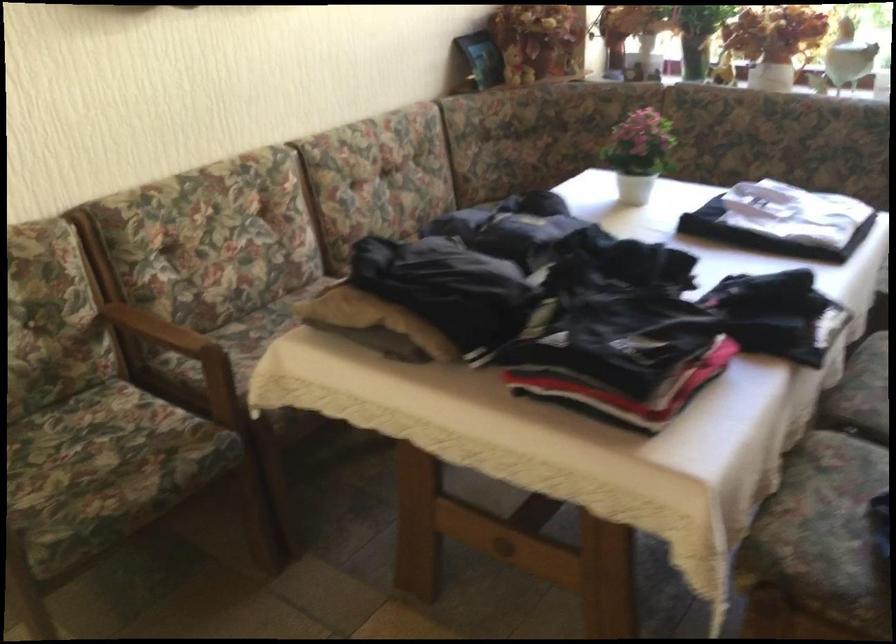
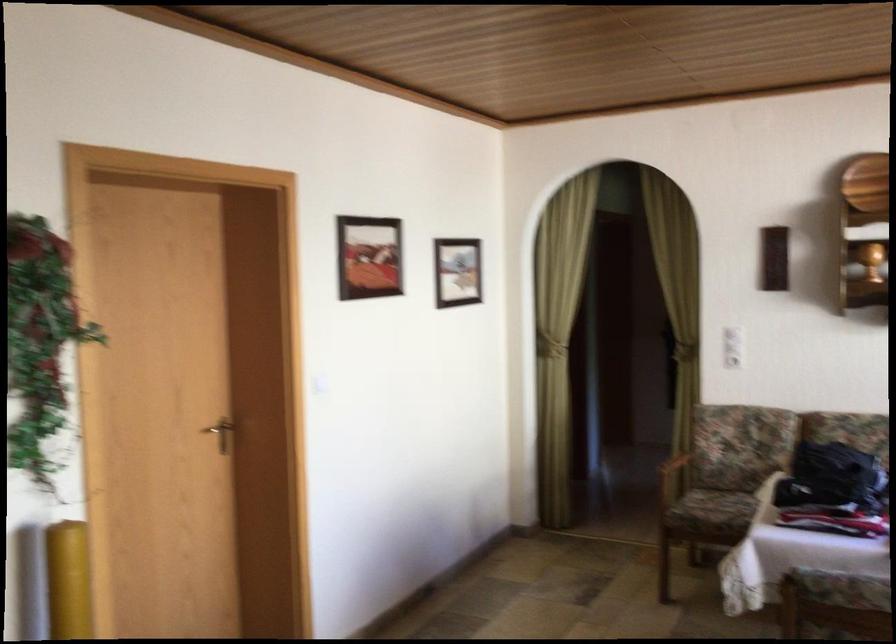
Question: I am providing you with two images of the same scene from different viewpoints. After the viewpoint changes to image2, which objects are now occluded?

Choices:
 (A) metal door handle
 (B) wooden chair armrest
 (C) yellow cylinder
 (D) colorful decorative plate

Answer: (B)